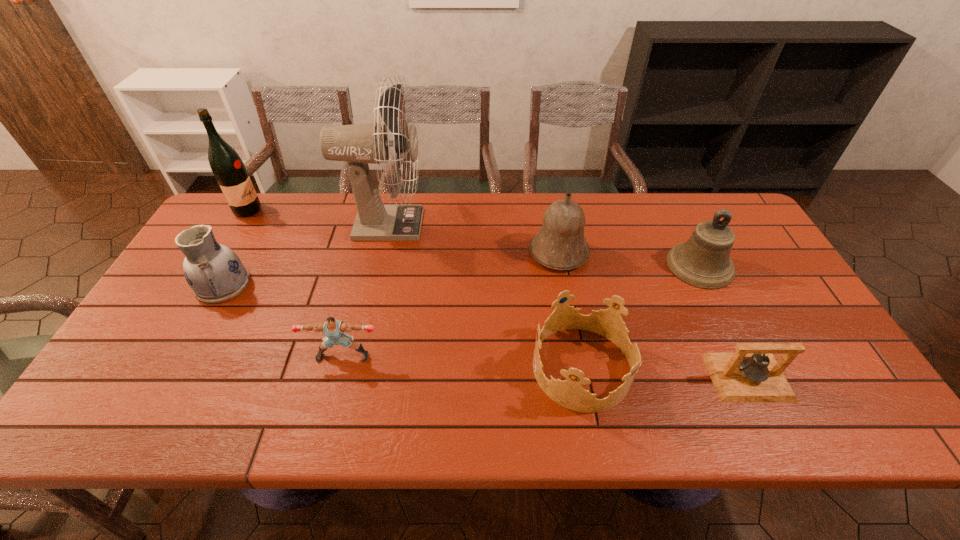
The width and height of the screenshot is (960, 540). I want to click on free space at the far left corner, so click(252, 228).

The image size is (960, 540). I want to click on free space between the tiara and the liquor, so click(415, 289).

Where is `free space between the tiara and the fan`? free space between the tiara and the fan is located at coordinates (484, 296).

What are the coordinates of `vacant region between the tallest object and the leftmost bell` in the screenshot? It's located at (472, 239).

This screenshot has width=960, height=540. Identify the location of empty space that is in between the leftmost bell and the puncher. (451, 304).

This screenshot has width=960, height=540. I want to click on free area in between the pottery and the liquor, so click(x=235, y=247).

Where is `free space between the tiara and the puncher`? The height and width of the screenshot is (540, 960). free space between the tiara and the puncher is located at coordinates 463,362.

Where is `empty space that is in between the tiara and the seventh shortest object`? empty space that is in between the tiara and the seventh shortest object is located at coordinates (415, 289).

Locate an element on the screen. This screenshot has width=960, height=540. object that is the third closest one to the seventh shortest object is located at coordinates (333, 329).

Find the location of a particular element. object that is the fifth closest to the shortest object is located at coordinates (359, 144).